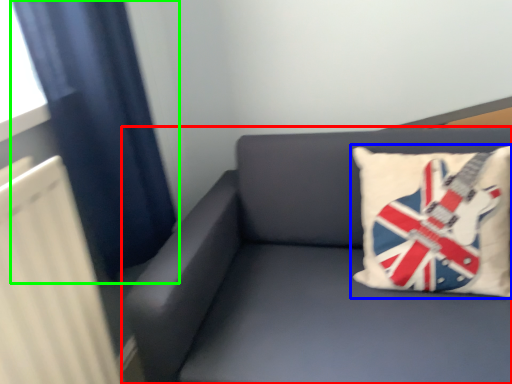
Question: Which object is positioned closest to studio couch (highlighted by a red box)? Select from pillow (highlighted by a blue box) and curtain (highlighted by a green box).

Choices:
 (A) pillow
 (B) curtain

Answer: (A)